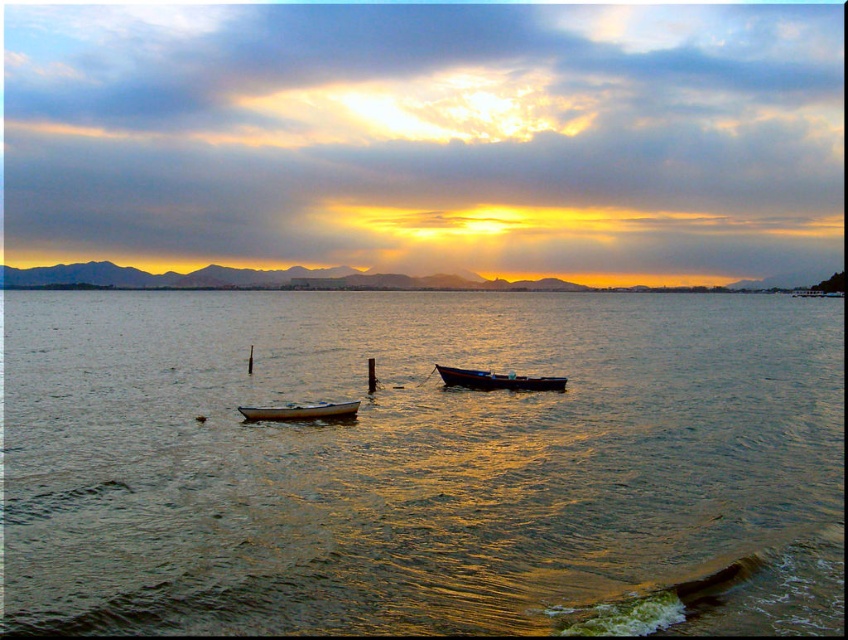
Does point (480, 628) lie in front of point (339, 403)?

Yes, it is.

Between greenish water at center and white glossy boat at center, which one appears on the left side from the viewer's perspective?

white glossy boat at center

Find the location of a particular element. greenish water at center is located at coordinates [400, 456].

Where is `greenish water at center`? The height and width of the screenshot is (640, 848). greenish water at center is located at coordinates (400, 456).

Who is more distant from viewer, [383,301] or [445,376]?

The point [383,301] is behind.

Between greenish water at center and wooden boat at center, which one appears on the right side from the viewer's perspective?

greenish water at center is more to the right.

Between point (76, 504) and point (547, 387), which one is positioned in front?

Point (76, 504)

Identify the location of greenish water at center. Image resolution: width=848 pixels, height=640 pixels. (400, 456).

Can you confirm if wooden boat at center is wider than white glossy boat at center?

Yes.

Is point (511, 372) positioned behind point (271, 406)?

Yes, it is behind point (271, 406).

The width and height of the screenshot is (848, 640). Identify the location of wooden boat at center. (497, 380).